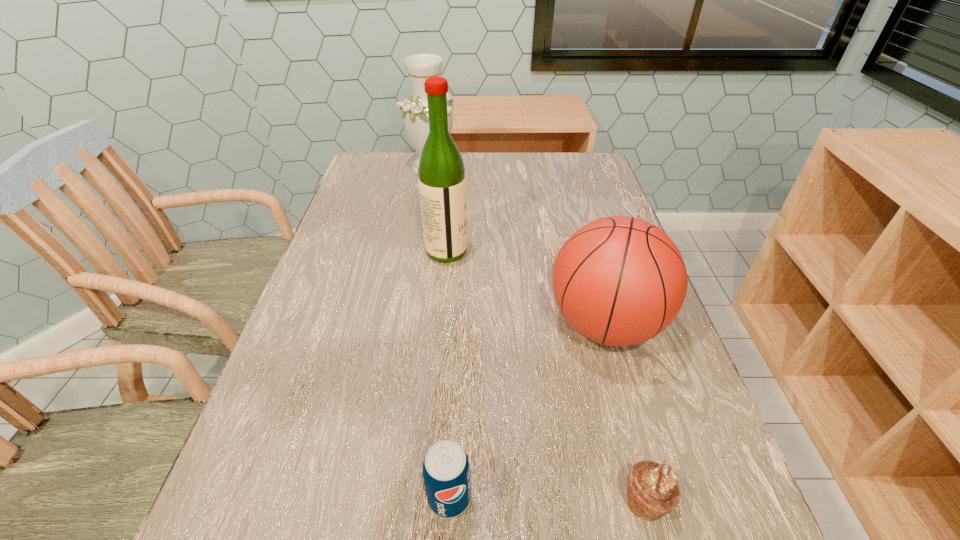
In the image, there is a desktop. Identify the location of vacant area at the right edge. The width and height of the screenshot is (960, 540). tap(666, 428).

You are a GUI agent. You are given a task and a screenshot of the screen. Output one action in this format:
    pyautogui.click(x=<x>, y=<y>)
    Task: Click on the vacant space at the far left corner
    This screenshot has height=540, width=960.
    Given the screenshot: What is the action you would take?
    pyautogui.click(x=376, y=157)

Where is `free space at the far right corner of the desktop`? free space at the far right corner of the desktop is located at coordinates (593, 189).

Where is `free space between the third farthest object and the farthest object`? This screenshot has height=540, width=960. free space between the third farthest object and the farthest object is located at coordinates (518, 246).

Locate an element on the screen. The image size is (960, 540). free space between the shortest object and the third farthest object is located at coordinates (625, 413).

Locate an element on the screen. vacant area that lies between the basketball and the shortest object is located at coordinates (625, 413).

The width and height of the screenshot is (960, 540). In order to click on free space between the shortest object and the vase in this screenshot , I will do `click(539, 334)`.

Where is `free spot between the shortest object and the third shortest object`? This screenshot has height=540, width=960. free spot between the shortest object and the third shortest object is located at coordinates (625, 413).

Locate an element on the screen. vacant area that lies between the muffin and the fourth nearest object is located at coordinates (546, 376).

At what (x,y) coordinates should I click in order to perform the action: click on vacant space that is in between the muffin and the liquor. Please return your answer as a coordinate pair (x, y). The width and height of the screenshot is (960, 540). Looking at the image, I should click on (546, 376).